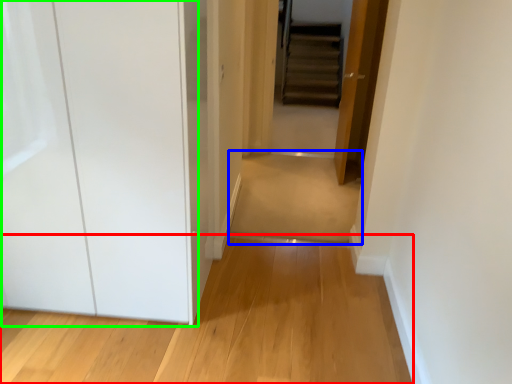
Question: Which object is the farthest from path (highlighted by a red box)? Choose among these: path (highlighted by a blue box) or glass door (highlighted by a green box).

Choices:
 (A) path
 (B) glass door

Answer: (A)